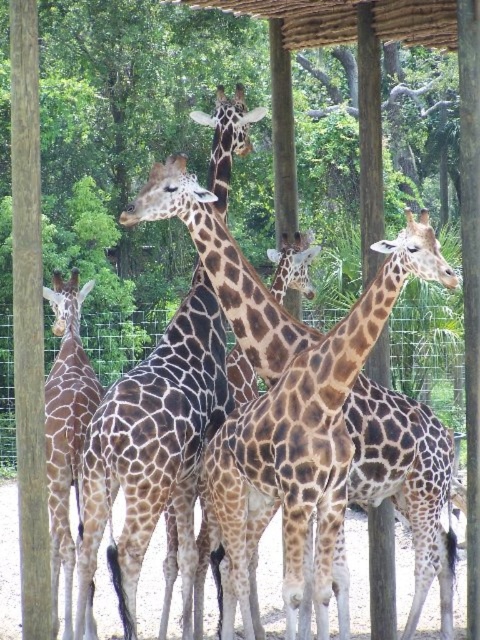
Question: Which is nearer to the brown wood pole at center?

Choices:
 (A) brown spotted giraffe at center
 (B) brown spotted giraffe at left

Answer: (A)

Question: Can you confirm if brown wood pole at left is bigger than brown wood pole at center?

Choices:
 (A) no
 (B) yes

Answer: (B)

Question: Which point is closer to the camera?

Choices:
 (A) brown spotted giraffe at left
 (B) brown spotted giraffe at center

Answer: (B)

Question: Which point is farther to the camera?

Choices:
 (A) (286, 371)
 (B) (474, 22)
 (C) (19, 372)

Answer: (B)

Question: Is brown spotted giraffe at center smaller than brown wood pole at center?

Choices:
 (A) yes
 (B) no

Answer: (B)

Question: Is brown spotted giraffe at center wider than brown wood pole at left?

Choices:
 (A) yes
 (B) no

Answer: (A)